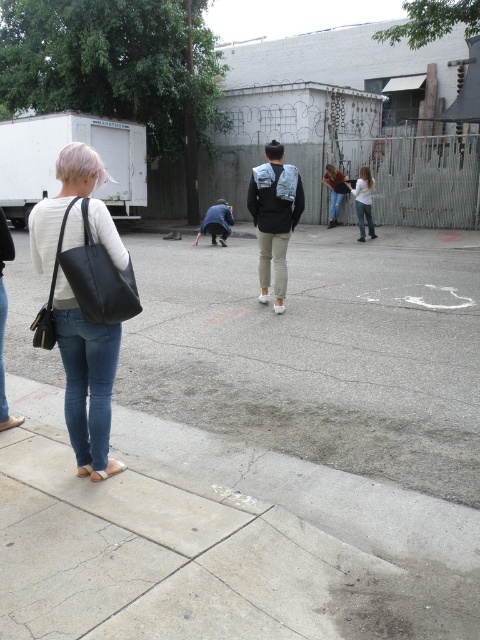
Can you confirm if blue denim jacket at center is wider than denim jacket at center?

Indeed, blue denim jacket at center has a greater width compared to denim jacket at center.

Is blue denim jacket at center behind denim jacket at center?

No.

Does point (222, 224) come farther from viewer compared to point (343, 176)?

No, (222, 224) is closer to viewer.

You are a GUI agent. You are given a task and a screenshot of the screen. Output one action in this format:
    pyautogui.click(x=<x>, y=<y>)
    Task: Click on the blue denim jacket at center
    The height and width of the screenshot is (640, 480).
    Given the screenshot: What is the action you would take?
    pyautogui.click(x=216, y=221)

Does matte black tote bag at left come in front of denim jacket at center?

That is True.

The image size is (480, 640). What are the coordinates of `matte black tote bag at left` in the screenshot? It's located at (x=86, y=381).

Is white matte shirt at center bigger than blue denim jacket at center?

Actually, white matte shirt at center might be smaller than blue denim jacket at center.

Is white matte shirt at center closer to camera compared to blue denim jacket at center?

No, white matte shirt at center is further to the viewer.

Where is `white matte shirt at center`? The height and width of the screenshot is (640, 480). white matte shirt at center is located at coordinates (363, 200).

Find the location of `white matte shirt at center`. white matte shirt at center is located at coordinates (363, 200).